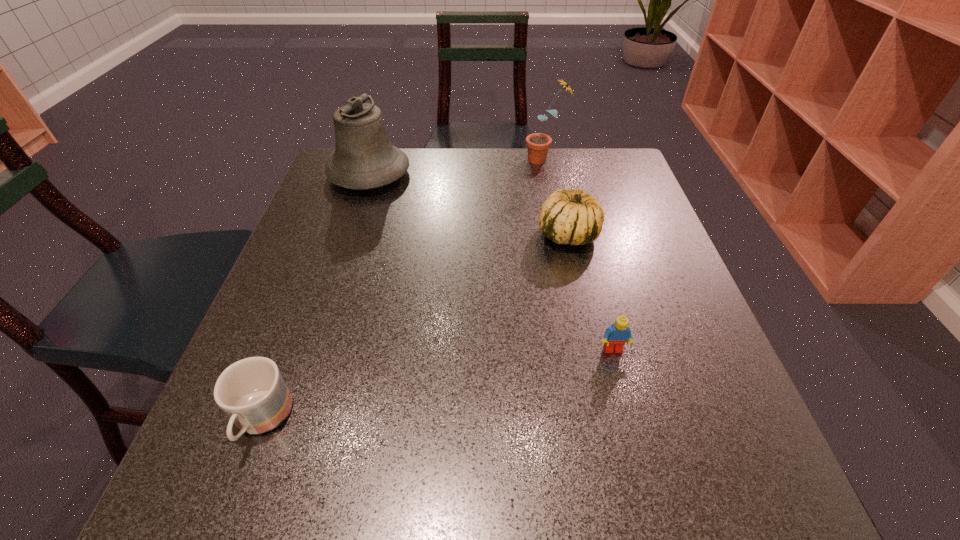
The image size is (960, 540). I want to click on vacant space situated on the left of the gourd, so click(432, 235).

You are a GUI agent. You are given a task and a screenshot of the screen. Output one action in this format:
    pyautogui.click(x=<x>, y=<y>)
    Task: Click on the free location located 0.050m on the face of the Lego
    
    Given the screenshot: What is the action you would take?
    pyautogui.click(x=621, y=381)

In order to click on vacant space located on the side with the handle of the mug in this screenshot , I will do `click(233, 495)`.

The image size is (960, 540). What are the coordinates of `sunflower that is at the far edge` in the screenshot? It's located at (538, 144).

Where is `bell that is at the far edge`? bell that is at the far edge is located at coordinates (364, 158).

This screenshot has height=540, width=960. Identify the location of object that is positioned at the near edge. (252, 392).

Image resolution: width=960 pixels, height=540 pixels. Find the location of `bell that is at the left edge`. bell that is at the left edge is located at coordinates (364, 158).

Find the location of a particular element. This screenshot has height=540, width=960. mug that is at the left edge is located at coordinates (x=252, y=392).

Locate an element on the screen. gourd that is positioned at the right edge is located at coordinates tap(568, 216).

Identify the location of Lego at the right edge. This screenshot has height=540, width=960. (615, 336).